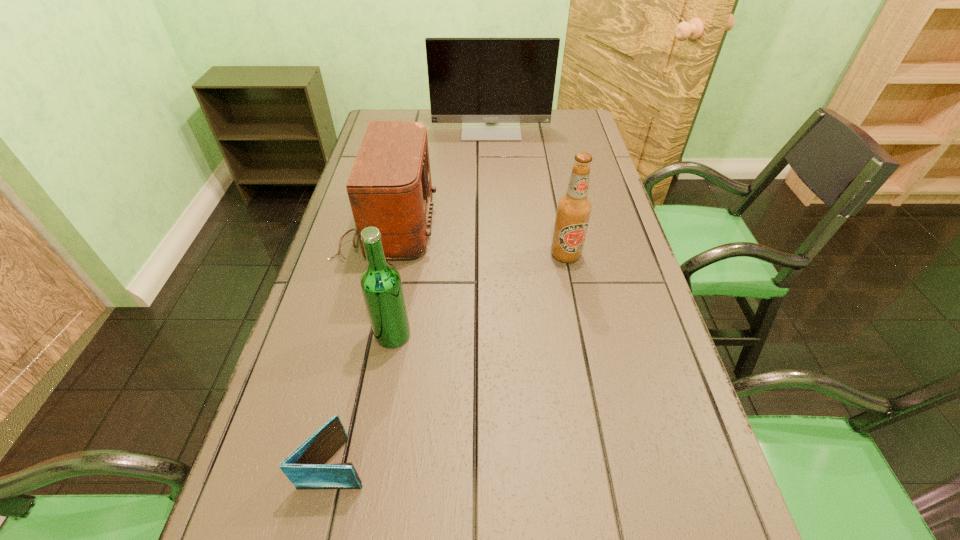
I want to click on computer monitor, so click(490, 85).

Locate an element on the screen. The image size is (960, 540). the nearer beer bottle is located at coordinates (381, 284).

Find the location of a particular element. Image resolution: width=960 pixels, height=540 pixels. the left beer bottle is located at coordinates (381, 284).

I want to click on the farther beer bottle, so click(x=573, y=210).

The width and height of the screenshot is (960, 540). I want to click on the second shortest object, so click(x=389, y=187).

You are a GUI agent. You are given a task and a screenshot of the screen. Output one action in this format:
    pyautogui.click(x=<x>, y=<y>)
    Task: Click on the wallet
    
    Given the screenshot: What is the action you would take?
    pyautogui.click(x=304, y=467)

Identify the location of the shortest object. This screenshot has width=960, height=540. (304, 467).

Where is `free region located 0.180m on the screen of the computer monitor`? This screenshot has height=540, width=960. free region located 0.180m on the screen of the computer monitor is located at coordinates (492, 170).

Locate an element on the screen. Image resolution: width=960 pixels, height=540 pixels. free spot located 0.200m on the right of the left beer bottle is located at coordinates (504, 335).

I want to click on vacant space located on the front label of the right beer bottle, so click(589, 374).